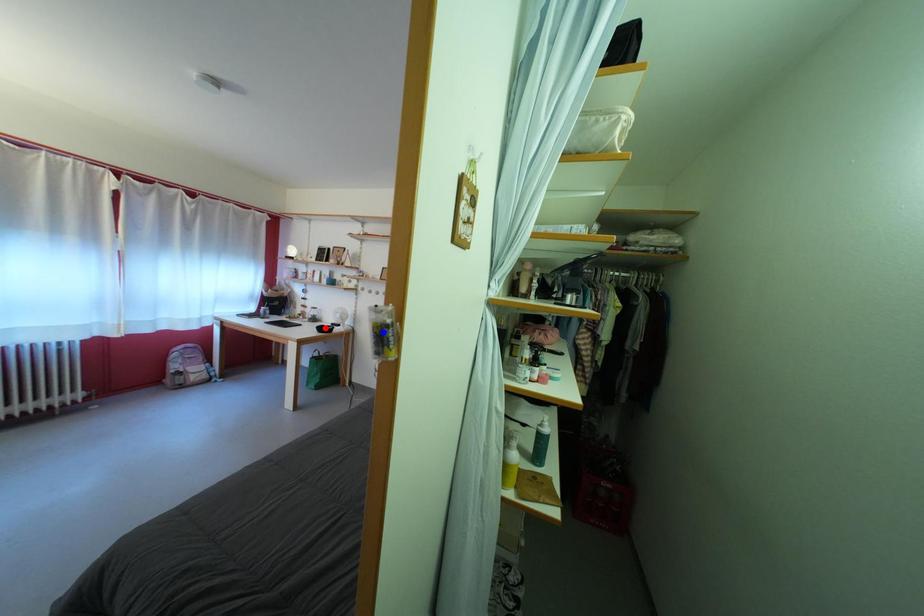
Question: Two points are marked on the image. Which point is closer to the camera?

Choices:
 (A) Blue point is closer.
 (B) Red point is closer.

Answer: (A)